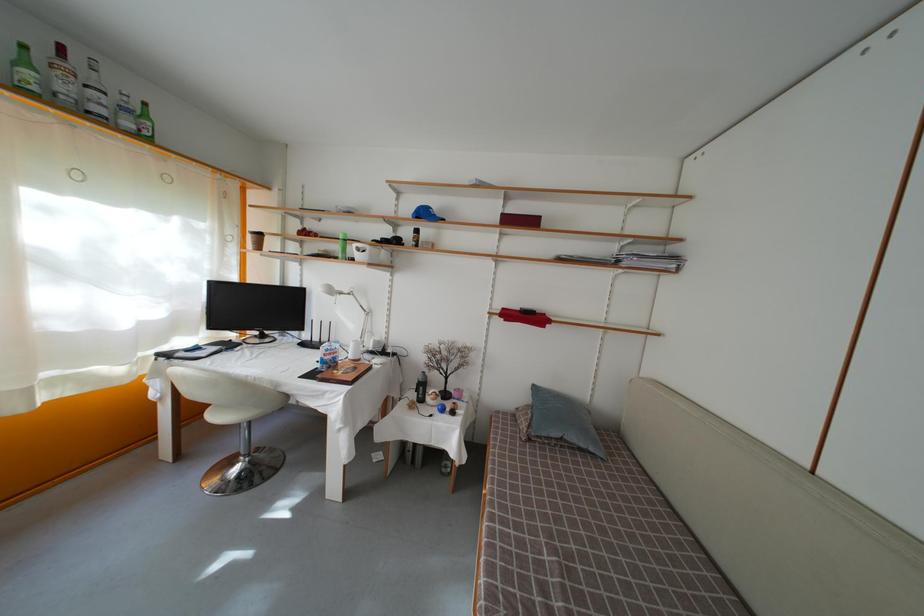
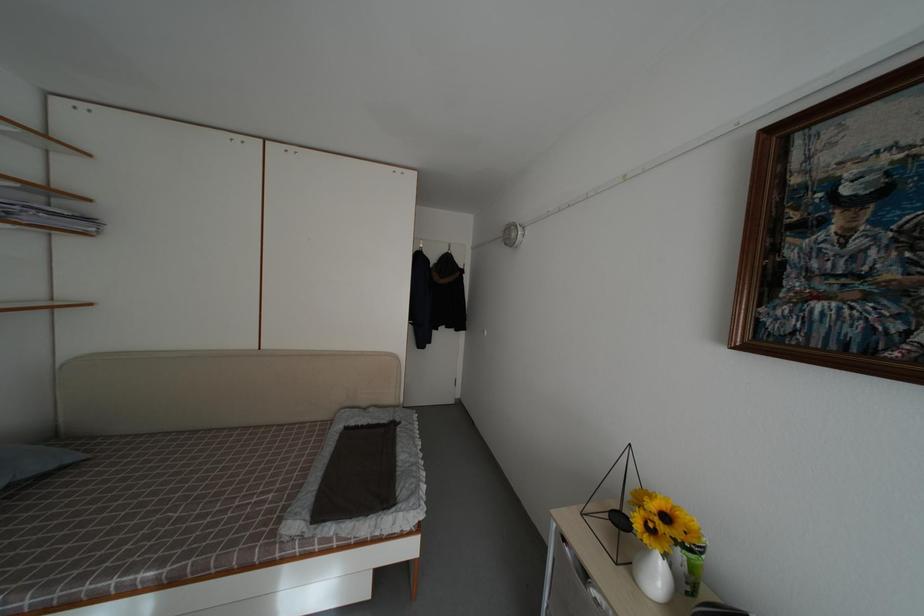
In the second image, find the point that corresponds to [682,264] in the first image.

(94, 225)